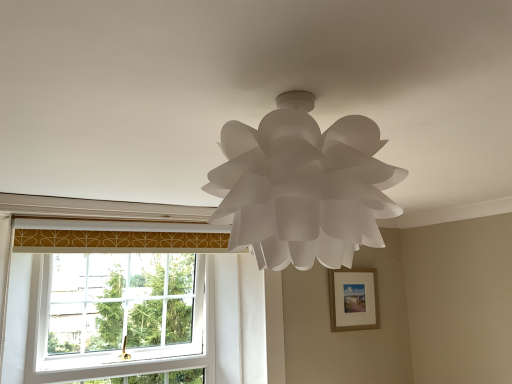
Question: Which is correct: white paper lamp at center is inside wooden picture frame at center-right, or outside of it?

Choices:
 (A) inside
 (B) outside

Answer: (B)

Question: Considering the positions of point (289, 97) and point (360, 317), is point (289, 97) closer or farther from the camera than point (360, 317)?

Choices:
 (A) closer
 (B) farther

Answer: (A)

Question: Considering the real-world distances, which object is farthest from the white paper lamp at center?

Choices:
 (A) white plastic window at lower left
 (B) wooden picture frame at center-right

Answer: (B)

Question: Which of these objects is positioned closest to the white plastic window at lower left?

Choices:
 (A) wooden picture frame at center-right
 (B) white paper lamp at center

Answer: (A)